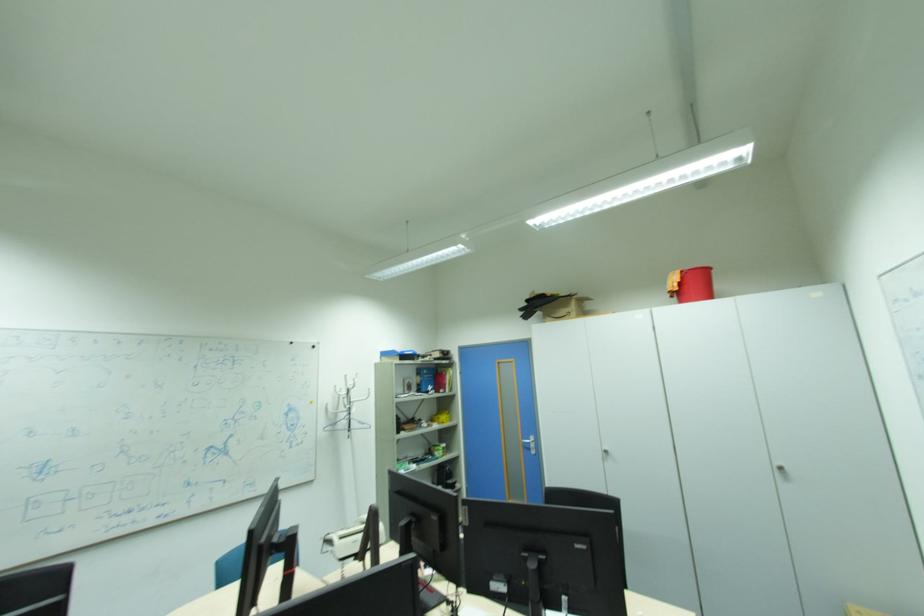
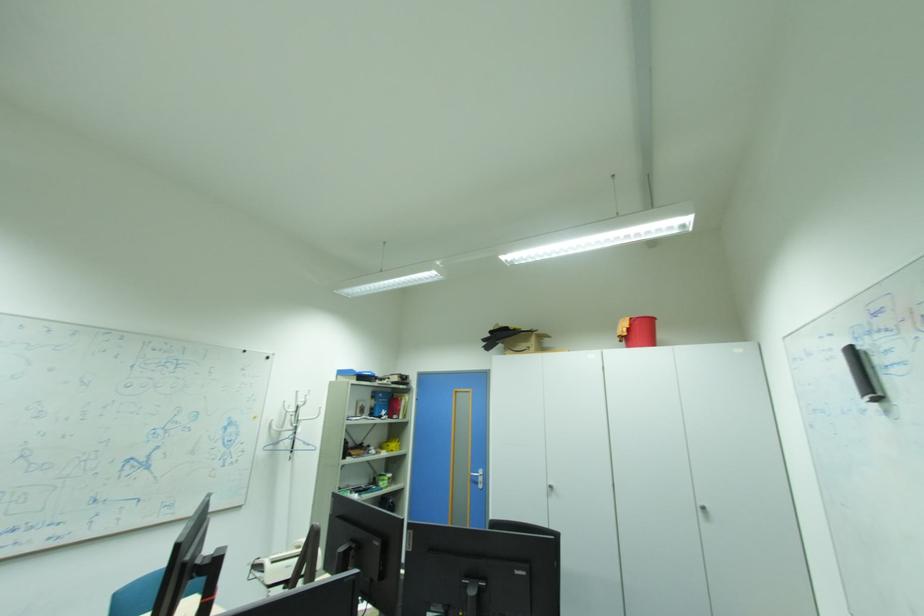
Question: Which direction would the cameraman need to move to produce the second image? Reply with the corresponding letter.

Choices:
 (A) Left
 (B) Right
 (C) Forward
 (D) Backward

Answer: (D)